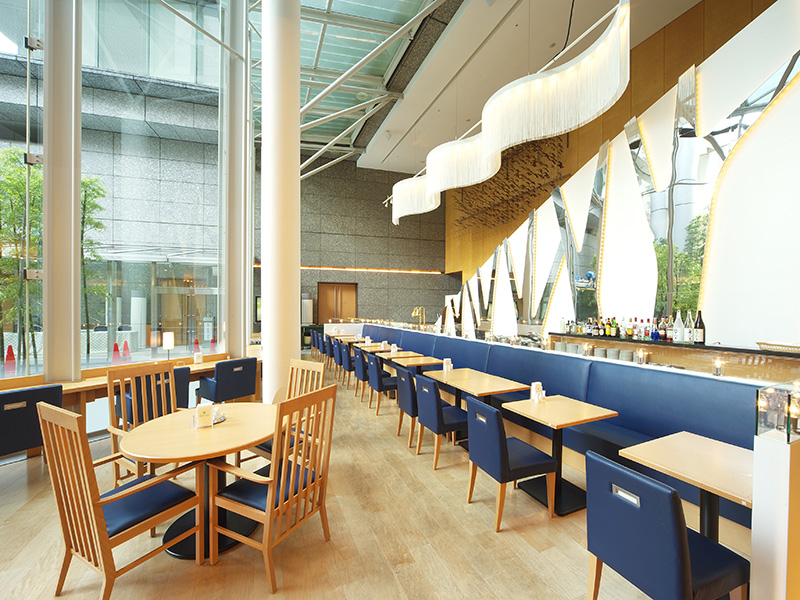
This screenshot has width=800, height=600. I want to click on tables, so click(x=710, y=469), click(x=185, y=439), click(x=562, y=409), click(x=474, y=380), click(x=416, y=362), click(x=405, y=353), click(x=374, y=345), click(x=362, y=341).